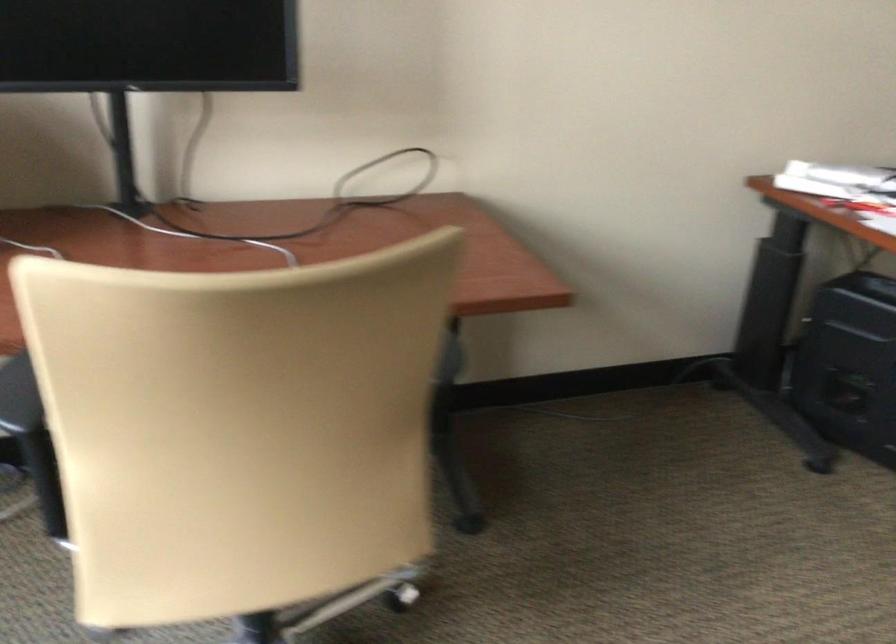
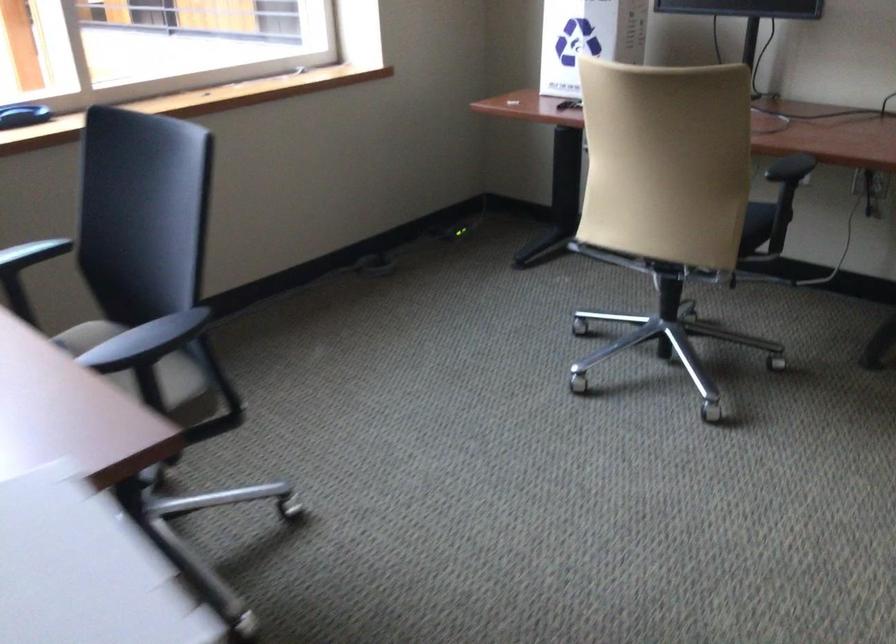
Where in the second image is the point corresponding to (x=436, y=372) from the first image?

(790, 167)